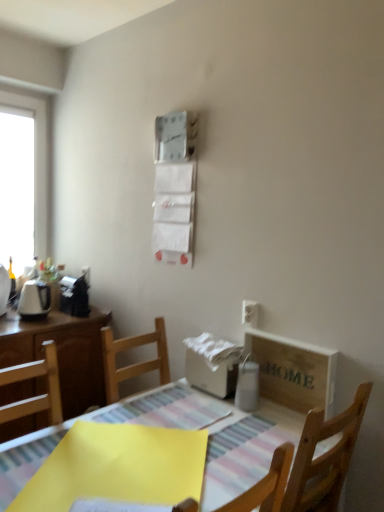
Find the location of a particular element. vacant region in front of wooden crate at lower right is located at coordinates (x=272, y=430).